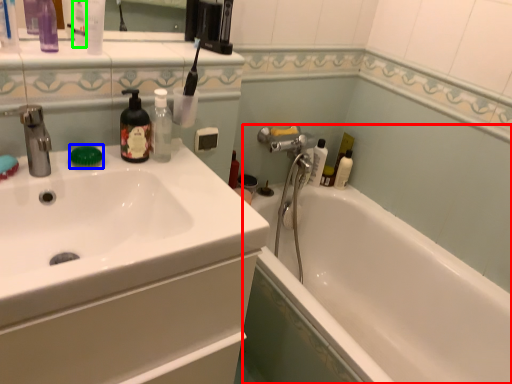
Question: Considering the real-world distances, which object is closest to bathtub (highlighted by a red box)? soap (highlighted by a blue box) or mouthwash (highlighted by a green box).

Choices:
 (A) soap
 (B) mouthwash

Answer: (A)